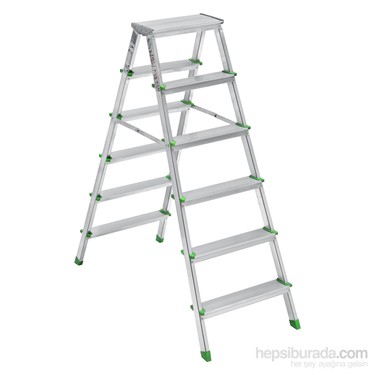
At what (x,y) coordinates should I click in order to perform the action: click on ladder. Please return your answer as a coordinate pair (x, y). The image size is (375, 375). Looking at the image, I should click on [176, 25].